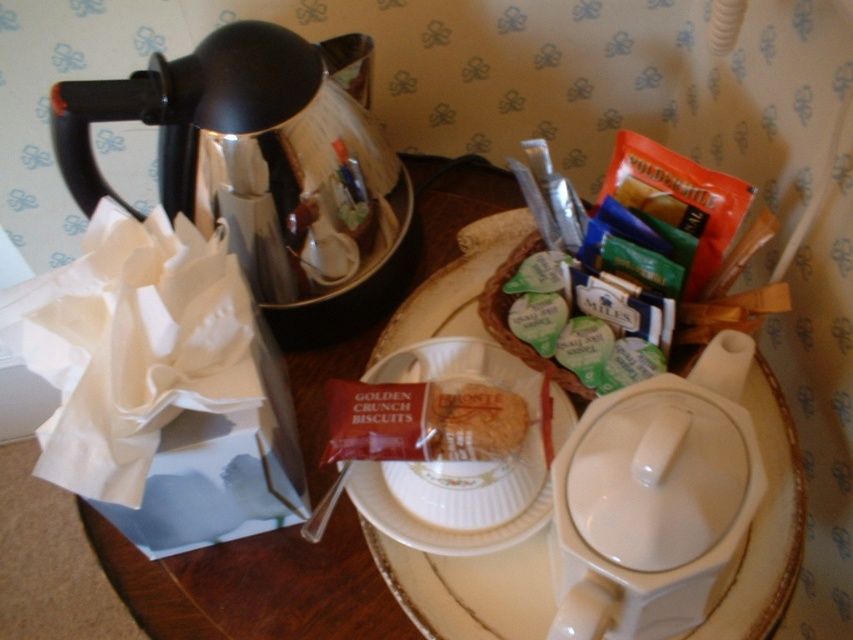
You are a barista preparing a drink and need to place a cup on the table. The cup you have is 3 inches in diameter. Can you safely place it between the shiny metallic coffee pot at left and the white ceramic saucer at center without touching either?

The distance between the shiny metallic coffee pot at left and the white ceramic saucer at center is 8.18 inches. Since the cup is 3 inches in diameter, there is enough space to place it between them without touching either object.

Looking at this image, you are setting up a tea party and need to choose between using the metallic spoon at lower center and the golden crunchy biscuit at center to stir your tea. Which item is more suitable for stirring based on their sizes?

The metallic spoon at lower center is larger in size compared to the golden crunchy biscuit at center, making it more suitable for stirring tea.

In the scene shown: You are a guest at a tea party and want to reach for the white ceramic saucer at center without moving the shiny metallic coffee pot at left. Is this possible?

The shiny metallic coffee pot at left is in front of the white ceramic saucer at center, so you can reach the white ceramic saucer at center by moving around the coffee pot since it is blocking the direct path.